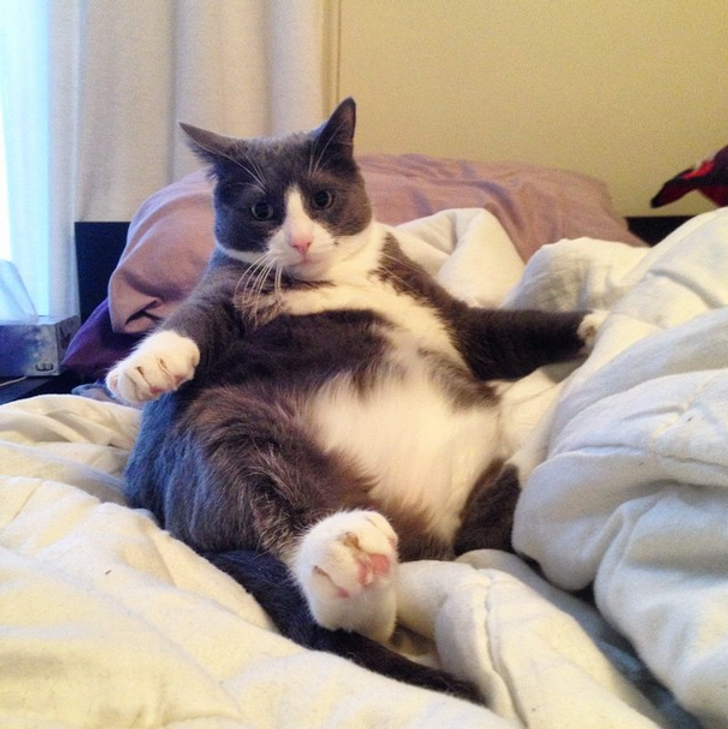
Locate an element on the screen. tissue is located at coordinates (17, 294).